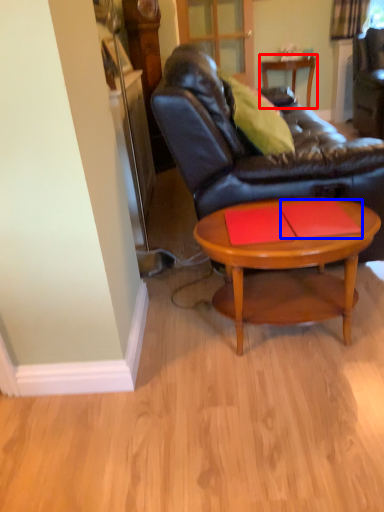
Question: Which of the following is the farthest to the observer, table (highlighted by a red box) or plank (highlighted by a blue box)?

Choices:
 (A) table
 (B) plank

Answer: (A)